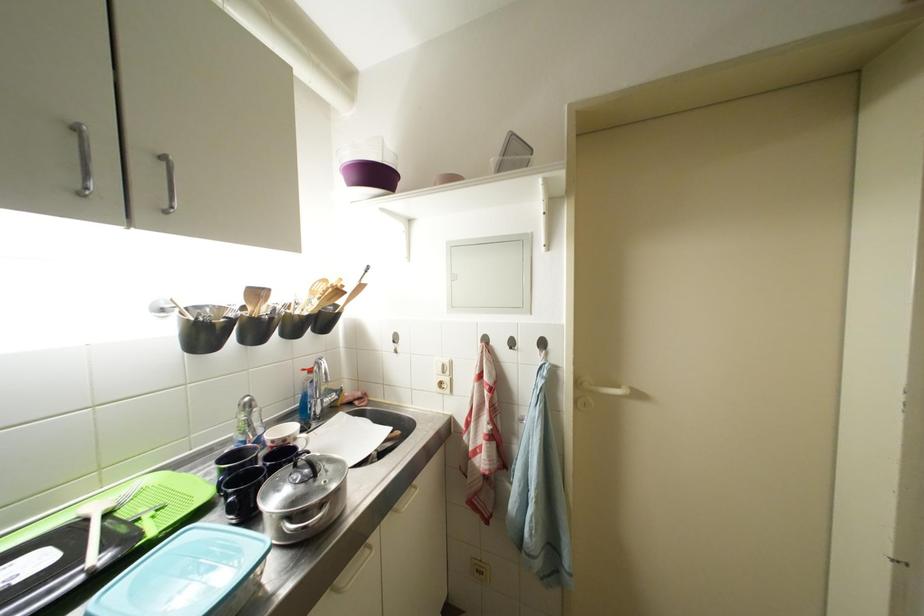
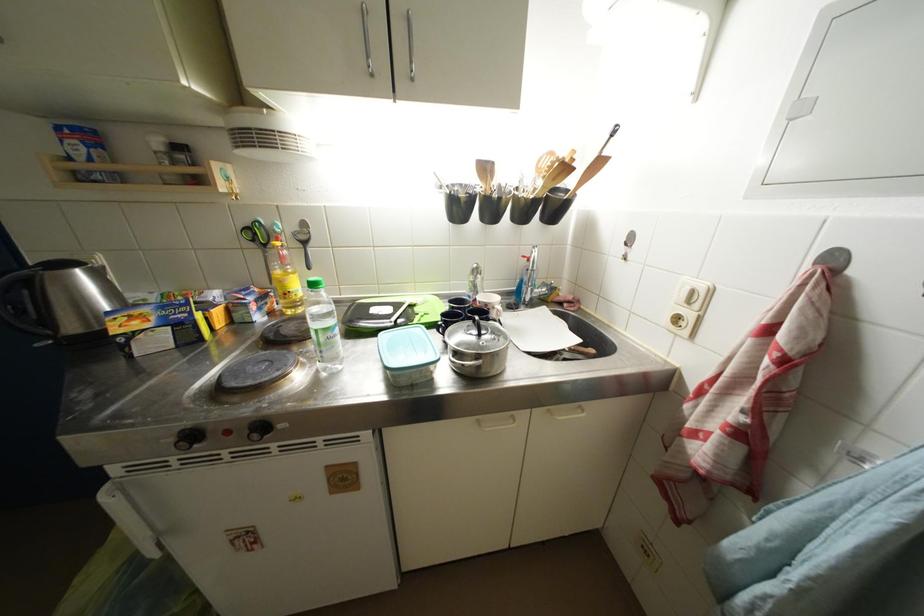
The point at (263, 298) is marked in the first image. Where is the corresponding point in the second image?

(492, 172)